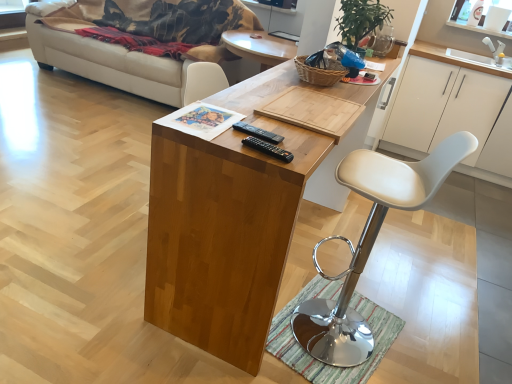
Where is `vacant space to the left of black plastic remote at center, the 1th remote in the front-to-back sequence`? This screenshot has width=512, height=384. vacant space to the left of black plastic remote at center, the 1th remote in the front-to-back sequence is located at coordinates (219, 132).